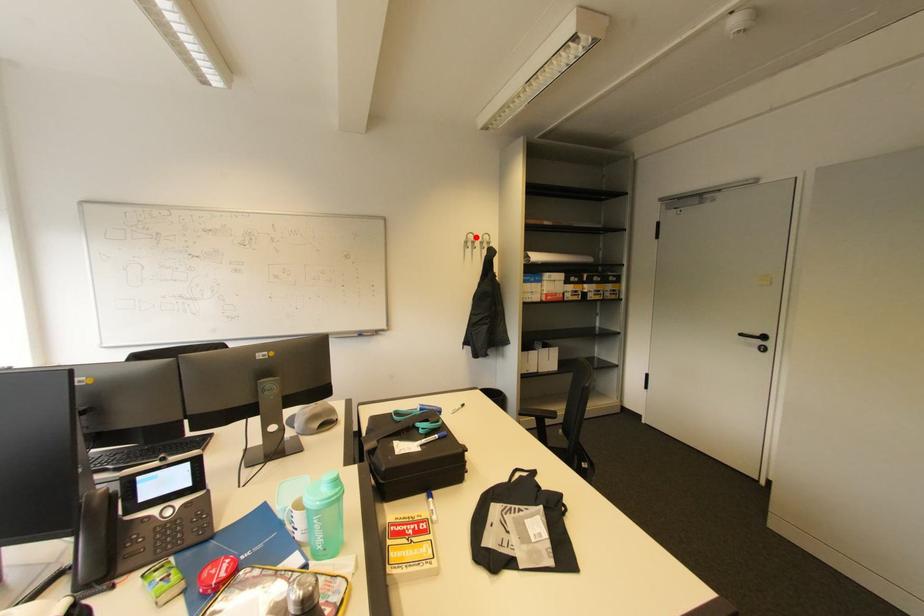
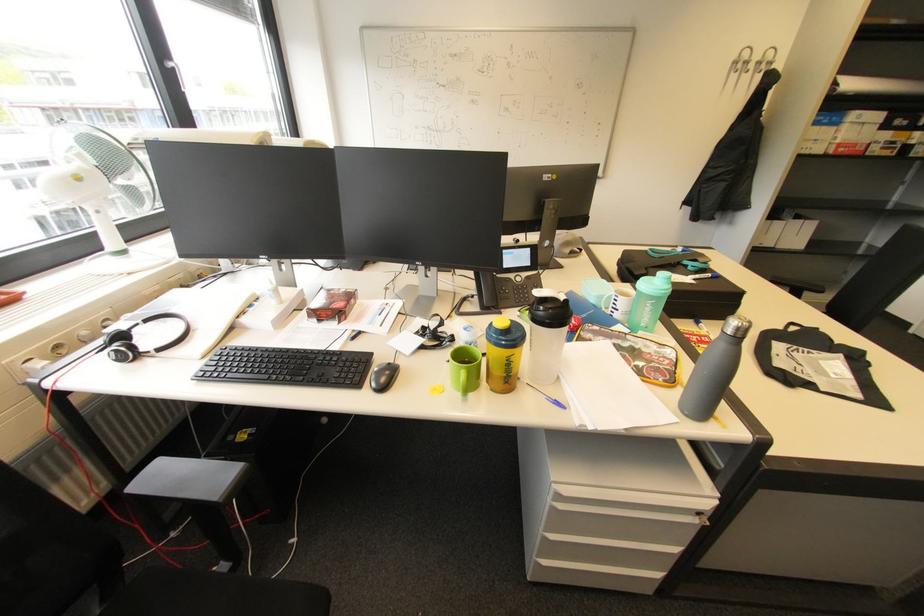
In the second image, find the point that corresponds to the highlighted location in the first image.

(751, 54)